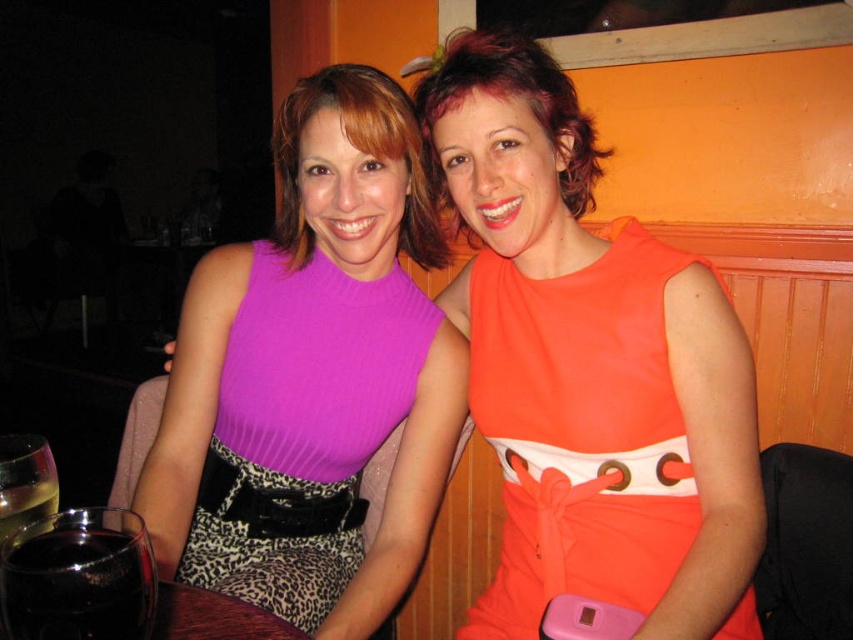
Who is taller, purple ribbed fabric dress at center or orange satin dress at center?

purple ribbed fabric dress at center

Who is more forward, (392,582) or (578,340)?

Point (578,340) is more forward.

You are a GUI agent. You are given a task and a screenshot of the screen. Output one action in this format:
    pyautogui.click(x=<x>, y=<y>)
    Task: Click on the purple ribbed fabric dress at center
    Image resolution: width=853 pixels, height=640 pixels.
    Given the screenshot: What is the action you would take?
    pyautogui.click(x=315, y=369)

Can you confirm if purple ribbed fabric dress at center is shorter than translucent glass at lower left?

Incorrect, purple ribbed fabric dress at center's height does not fall short of translucent glass at lower left's.

Does purple ribbed fabric dress at center appear on the right side of translucent glass at lower left?

Indeed, purple ribbed fabric dress at center is positioned on the right side of translucent glass at lower left.

Which is in front, point (346, 257) or point (28, 477)?

Point (28, 477) is more forward.

I want to click on purple ribbed fabric dress at center, so click(315, 369).

In the scene shown: Who is taller, translucent glass wine at lower left or leopard print fabric belt at lower center?

leopard print fabric belt at lower center is taller.

Is point (32, 532) farther from camera compared to point (207, 512)?

No, it is not.

Identify the location of translucent glass wine at lower left. (78, 577).